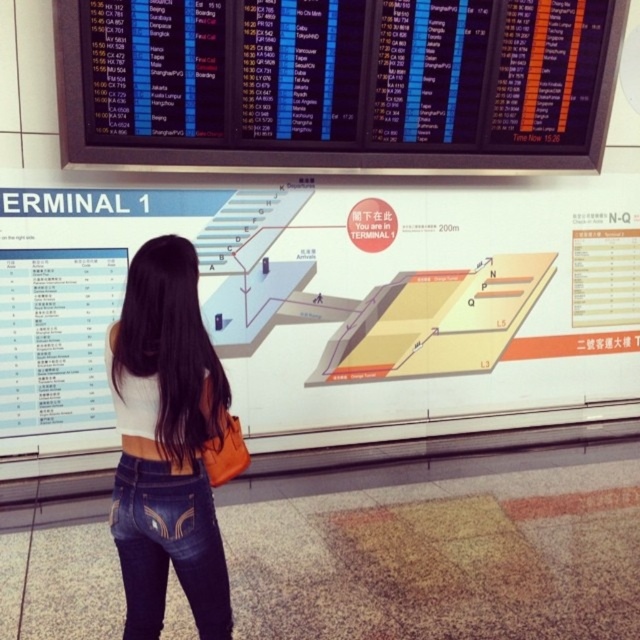
Does point (561, 124) come in front of point (138, 531)?

No, (561, 124) is further to viewer.

Based on the photo, between black plastic flight information display at upper center and white matte tank top at center, which one has more height?

black plastic flight information display at upper center is taller.

Between point (449, 68) and point (221, 632), which one is positioned behind?

The point (449, 68) is behind.

I want to click on black plastic flight information display at upper center, so point(369,88).

Is white matte tank top at center smaller than denim at center?

Incorrect, white matte tank top at center is not smaller in size than denim at center.

Can you confirm if white matte tank top at center is thinner than denim at center?

No.

Find the location of a particular element. Image resolution: width=640 pixels, height=640 pixels. white matte tank top at center is located at coordinates (166, 444).

Between white glossy map at upper center and black plastic flight information display at upper center, which one appears on the left side from the viewer's perspective?

Positioned to the left is black plastic flight information display at upper center.

The image size is (640, 640). In order to click on white glossy map at upper center in this screenshot , I will do `click(328, 298)`.